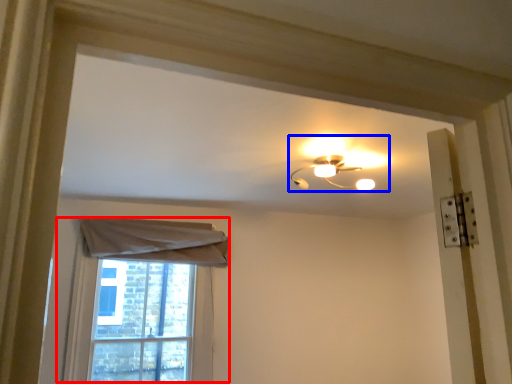
Question: Which of the following is the closest to the observer, window (highlighted by a red box) or lamp (highlighted by a blue box)?

Choices:
 (A) window
 (B) lamp

Answer: (B)